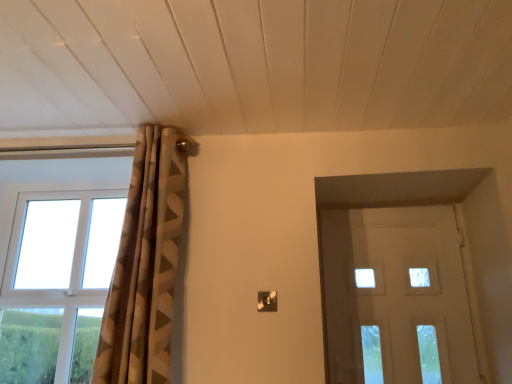
Question: Considering the relative sizes of white plastic window at left and brown textured curtain at upper left in the image provided, is white plastic window at left taller than brown textured curtain at upper left?

Choices:
 (A) no
 (B) yes

Answer: (A)

Question: Is white plastic window at left oriented away from brown textured curtain at upper left?

Choices:
 (A) no
 (B) yes

Answer: (A)

Question: Is white plastic window at left beside brown textured curtain at upper left?

Choices:
 (A) no
 (B) yes

Answer: (A)

Question: From the image's perspective, is white plastic window at left on top of brown textured curtain at upper left?

Choices:
 (A) yes
 (B) no

Answer: (B)

Question: Does white plastic window at left have a smaller size compared to brown textured curtain at upper left?

Choices:
 (A) yes
 (B) no

Answer: (A)

Question: Is the position of white plastic window at left more distant than that of brown textured curtain at upper left?

Choices:
 (A) no
 (B) yes

Answer: (B)

Question: Is brown textured curtain at upper left in front of white frosted glass door at right?

Choices:
 (A) yes
 (B) no

Answer: (A)

Question: Is brown textured curtain at upper left outside of white frosted glass door at right?

Choices:
 (A) yes
 (B) no

Answer: (A)

Question: Can you confirm if brown textured curtain at upper left is taller than white frosted glass door at right?

Choices:
 (A) no
 (B) yes

Answer: (B)

Question: Considering the relative positions of brown textured curtain at upper left and white frosted glass door at right in the image provided, is brown textured curtain at upper left to the right of white frosted glass door at right from the viewer's perspective?

Choices:
 (A) yes
 (B) no

Answer: (B)

Question: Is brown textured curtain at upper left next to white frosted glass door at right and touching it?

Choices:
 (A) no
 (B) yes

Answer: (A)

Question: Is white frosted glass door at right surrounded by brown textured curtain at upper left?

Choices:
 (A) no
 (B) yes

Answer: (A)

Question: Considering the relative sizes of brown textured curtain at upper left and white plastic window at left in the image provided, is brown textured curtain at upper left taller than white plastic window at left?

Choices:
 (A) yes
 (B) no

Answer: (A)